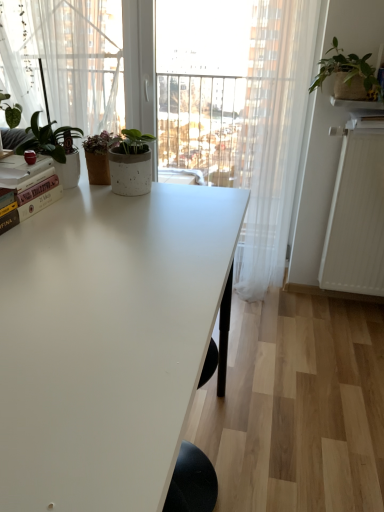
Question: Considering the positions of white matte table at center and white ceramic shelf at upper right in the image, is white matte table at center bigger or smaller than white ceramic shelf at upper right?

Choices:
 (A) big
 (B) small

Answer: (A)

Question: Is white matte table at center wider or thinner than white ceramic shelf at upper right?

Choices:
 (A) wide
 (B) thin

Answer: (A)

Question: Which object is the farthest from the hardcover book at left?

Choices:
 (A) matte white pot at upper left, marked as the first houseplant in a bottom-to-top arrangement
 (B) white matte table at center
 (C) white textured radiator at right
 (D) white sheer curtain at right
 (E) white ceramic shelf at upper right

Answer: (C)

Question: Which of these objects is positioned closest to the white matte table at center?

Choices:
 (A) matte white pot at upper left, marked as the first houseplant in a bottom-to-top arrangement
 (B) burlap-textured plant at upper right, the 1th houseplant from the back
 (C) white textured radiator at right
 (D) white ceramic shelf at upper right
 (E) hardcover book at left

Answer: (E)